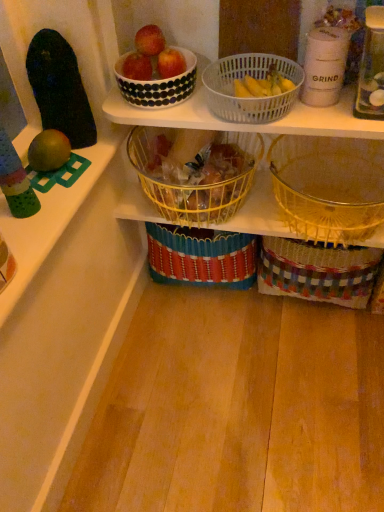
Where is `free space in front of matte black bowl at upper center, which appears as the 3th apple when viewed from the right`? This screenshot has height=512, width=384. free space in front of matte black bowl at upper center, which appears as the 3th apple when viewed from the right is located at coordinates (158, 106).